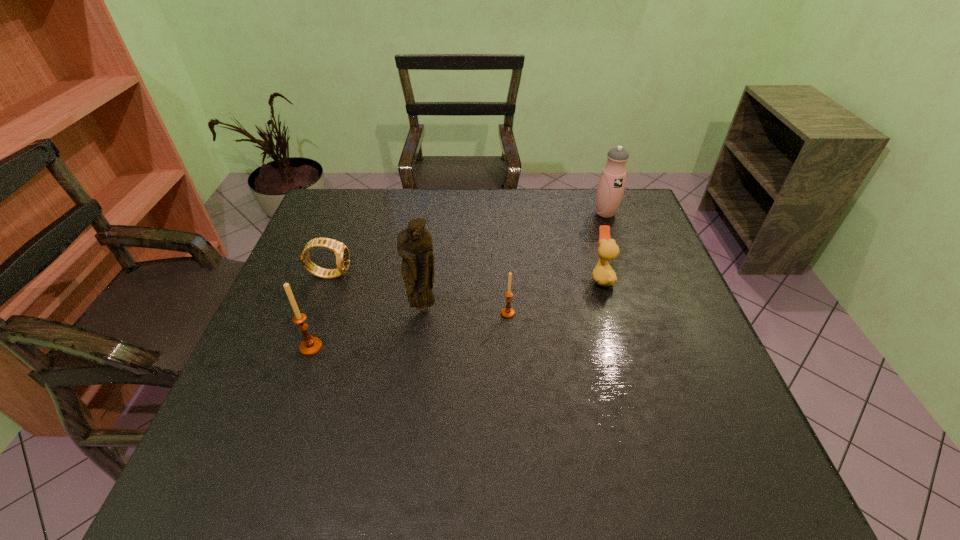
At what (x,y) coordinates should I click in order to perform the action: click on watch that is at the left edge. Please return your answer as a coordinate pair (x, y). This screenshot has height=540, width=960. Looking at the image, I should click on (341, 251).

At what (x,y) coordinates should I click in order to perform the action: click on object located in the right edge section of the desktop. Please return your answer as a coordinate pair (x, y). The width and height of the screenshot is (960, 540). Looking at the image, I should click on (611, 185).

This screenshot has height=540, width=960. What are the coordinates of `object present at the far right corner` in the screenshot? It's located at (611, 185).

The width and height of the screenshot is (960, 540). Find the location of `vacant space at the far edge`. vacant space at the far edge is located at coordinates (428, 225).

Where is `blank space at the near edge of the desktop`? The image size is (960, 540). blank space at the near edge of the desktop is located at coordinates (560, 417).

This screenshot has width=960, height=540. I want to click on free space at the left edge of the desktop, so click(275, 308).

Locate an element on the screen. The width and height of the screenshot is (960, 540). vacant space at the right edge of the desktop is located at coordinates (639, 277).

Identify the location of vacant space at the far left corner. (332, 204).

Where is `vacant space at the far right corner`? The image size is (960, 540). vacant space at the far right corner is located at coordinates coord(612,226).

Locate an element on the screen. Image resolution: width=960 pixels, height=540 pixels. vacant point located between the rightmost object and the tallest object is located at coordinates (515, 261).